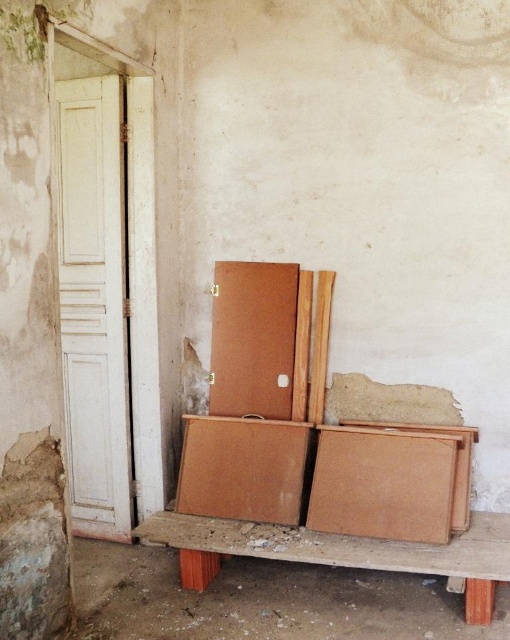
From the picture: Is brown cardboard box at lower center taller than brown cardboard box at center?

No, brown cardboard box at lower center is not taller than brown cardboard box at center.

Who is more forward, (x=395, y=493) or (x=306, y=436)?

Positioned in front is point (x=395, y=493).

Which is behind, point (346, 525) or point (267, 449)?

Point (267, 449)

The height and width of the screenshot is (640, 510). I want to click on brown cardboard box at lower center, so click(392, 481).

Between wooden bench at lower center and brown cardboard box at center, which one has less height?

wooden bench at lower center is shorter.

Can you confirm if wooden bench at lower center is smaller than brown cardboard box at center?

Incorrect, wooden bench at lower center is not smaller in size than brown cardboard box at center.

Which is behind, point (481, 545) or point (197, 490)?

Positioned behind is point (197, 490).

Where is `wooden bench at lower center`? Image resolution: width=510 pixels, height=640 pixels. wooden bench at lower center is located at coordinates (341, 552).

Is brown cardboard box at lower center wider than wooden bench at lower center?

In fact, brown cardboard box at lower center might be narrower than wooden bench at lower center.

Does brown cardboard box at lower center appear on the right side of wooden bench at lower center?

Yes, brown cardboard box at lower center is to the right of wooden bench at lower center.

Which is behind, point (404, 500) or point (484, 540)?

Point (404, 500)

The height and width of the screenshot is (640, 510). Find the location of `brown cardboard box at lower center`. brown cardboard box at lower center is located at coordinates click(x=392, y=481).